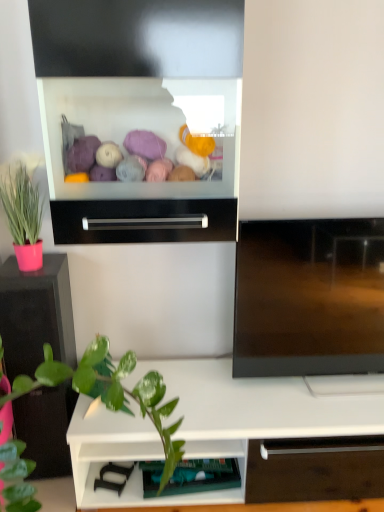
Question: Is white matte shelf at lower center, the 1th shelf viewed from the right, to the left of pink matte pot at left from the viewer's perspective?

Choices:
 (A) yes
 (B) no

Answer: (B)

Question: Can we say white matte shelf at lower center, the 1th shelf viewed from the right, lies outside pink matte pot at left?

Choices:
 (A) no
 (B) yes

Answer: (B)

Question: From the image's perspective, is white matte shelf at lower center, which appears as the second shelf when viewed from the left, located above pink matte pot at left?

Choices:
 (A) yes
 (B) no

Answer: (B)

Question: Is white matte shelf at lower center, the 1th shelf viewed from the right, not near pink matte pot at left?

Choices:
 (A) no
 (B) yes

Answer: (A)

Question: Is the depth of white matte shelf at lower center, the 1th shelf viewed from the right, greater than that of pink matte pot at left?

Choices:
 (A) no
 (B) yes

Answer: (B)

Question: From the image's perspective, is black metallic drawer at center above or below white matte shelf at lower center, which appears as the second shelf when viewed from the left?

Choices:
 (A) above
 (B) below

Answer: (A)

Question: From a real-world perspective, is black metallic drawer at center above or below white matte shelf at lower center, the 1th shelf viewed from the right?

Choices:
 (A) below
 (B) above

Answer: (B)

Question: Based on their sizes in the image, would you say black metallic drawer at center is bigger or smaller than white matte shelf at lower center, which appears as the second shelf when viewed from the left?

Choices:
 (A) big
 (B) small

Answer: (B)

Question: Considering the positions of black metallic drawer at center and white matte shelf at lower center, the 1th shelf viewed from the right, in the image, is black metallic drawer at center wider or thinner than white matte shelf at lower center, the 1th shelf viewed from the right,?

Choices:
 (A) thin
 (B) wide

Answer: (A)

Question: From the image's perspective, is white matte shelf at lower center, the 1th shelf viewed from the right, above or below pink matte pot at left?

Choices:
 (A) above
 (B) below

Answer: (B)

Question: Considering the positions of white matte shelf at lower center, the 1th shelf viewed from the right, and pink matte pot at left in the image, is white matte shelf at lower center, the 1th shelf viewed from the right, wider or thinner than pink matte pot at left?

Choices:
 (A) wide
 (B) thin

Answer: (A)

Question: Visually, is white matte shelf at lower center, the 1th shelf viewed from the right, positioned to the left or to the right of pink matte pot at left?

Choices:
 (A) right
 (B) left

Answer: (A)

Question: In the image, is white matte shelf at lower center, which appears as the second shelf when viewed from the left, positioned in front of or behind pink matte pot at left?

Choices:
 (A) front
 (B) behind

Answer: (B)

Question: Considering their positions, is white matte shelf at lower center, the 1th shelf viewed from the right, located in front of or behind black glossy tv cabinet at left?

Choices:
 (A) behind
 (B) front

Answer: (A)

Question: Do you think white matte shelf at lower center, which appears as the second shelf when viewed from the left, is within black glossy tv cabinet at left, or outside of it?

Choices:
 (A) inside
 (B) outside

Answer: (B)